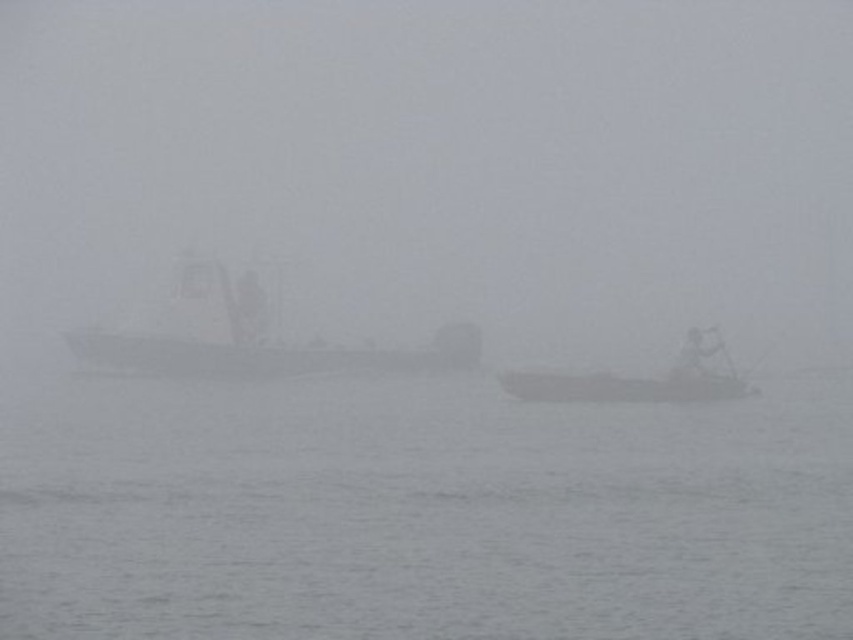
You are a sailor trying to navigate through the fog. You see the gray water at center and the smooth gray boat at center. Which one is directly above the other?

The smooth gray boat at center is positioned above the gray water at center, as the gray water at center is under it.

You are a sailor trying to navigate through the fog. You see two boats ahead, the smooth gray boat at center and the smooth white boat at center. Which boat is located to the left of the other?

The smooth gray boat at center is positioned on the left side of the smooth white boat at center.